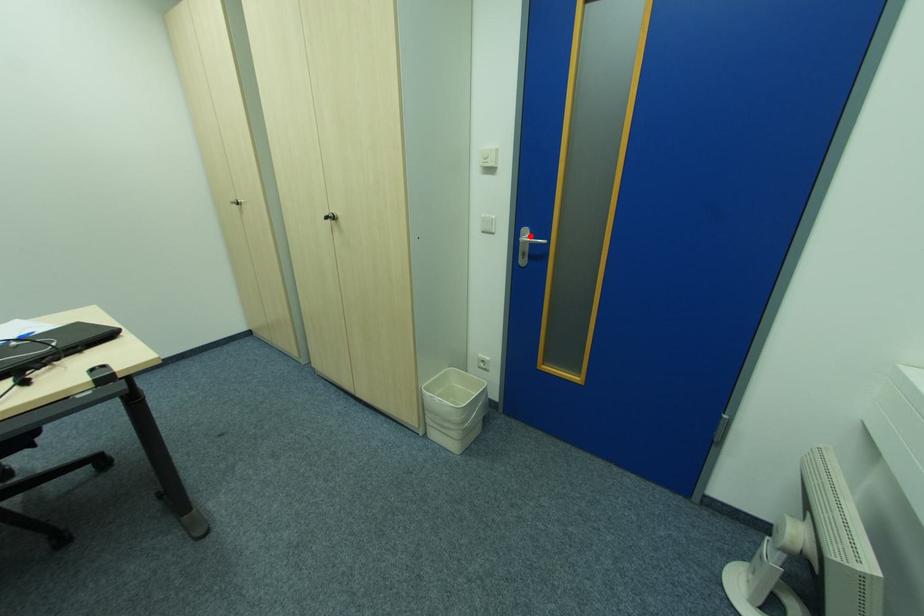
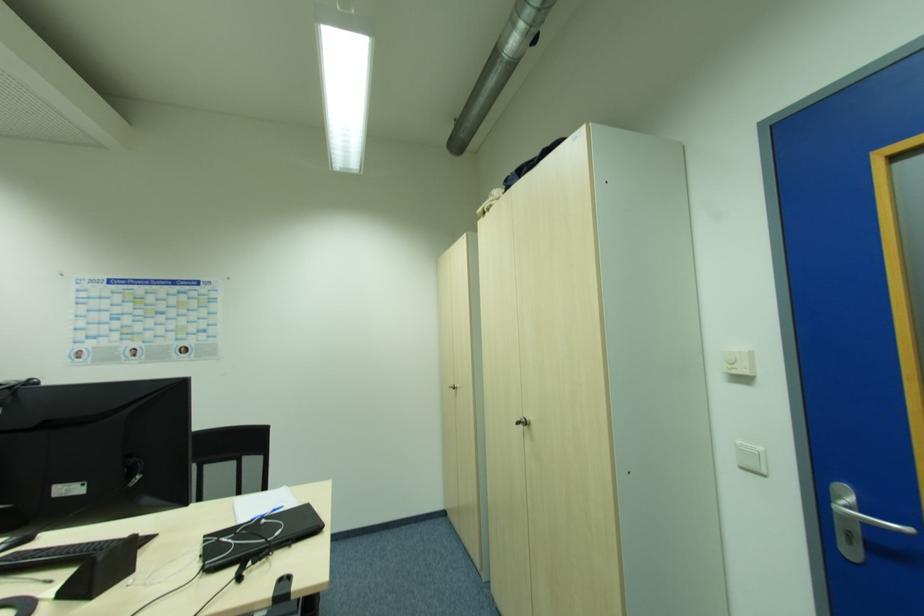
In the second image, find the point that corresponds to the highlighted location in the first image.

(855, 501)